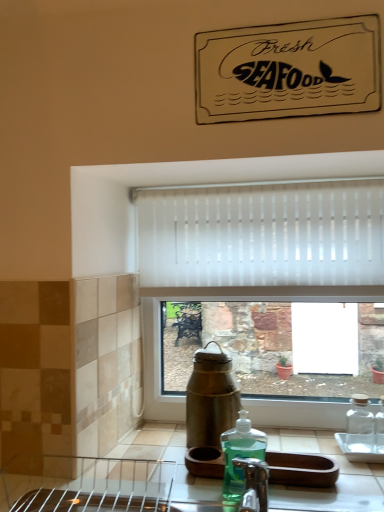
The image size is (384, 512). What do you see at coordinates (240, 454) in the screenshot? I see `green translucent liquid soap at lower center` at bounding box center [240, 454].

In order to click on green translucent liquid soap at lower center in this screenshot , I will do `click(240, 454)`.

Locate an element on the screen. This screenshot has width=384, height=512. white translucent blinds at center is located at coordinates (262, 234).

The height and width of the screenshot is (512, 384). Describe the element at coordinates (262, 234) in the screenshot. I see `white translucent blinds at center` at that location.

Find the location of a particular element. The image size is (384, 512). green translucent liquid soap at lower center is located at coordinates tap(240, 454).

Considering the positions of objects white translucent blinds at center and green translucent liquid soap at lower center in the image provided, who is more to the right, white translucent blinds at center or green translucent liquid soap at lower center?

white translucent blinds at center.

Which object is further away from the camera taking this photo, white translucent blinds at center or green translucent liquid soap at lower center?

white translucent blinds at center is more distant.

Which point is more distant from viewer, (308, 212) or (249, 439)?

The point (308, 212) is farther.

From the image's perspective, would you say white translucent blinds at center is shown under green translucent liquid soap at lower center?

Incorrect, from the image's perspective, white translucent blinds at center is higher than green translucent liquid soap at lower center.

From a real-world perspective, which is physically above, white translucent blinds at center or green translucent liquid soap at lower center?

From a 3D spatial view, white translucent blinds at center is above.

Which object is thinner, white translucent blinds at center or green translucent liquid soap at lower center?

white translucent blinds at center.

Considering the sizes of white translucent blinds at center and green translucent liquid soap at lower center in the image, is white translucent blinds at center taller or shorter than green translucent liquid soap at lower center?

Clearly, white translucent blinds at center is taller compared to green translucent liquid soap at lower center.

Considering the sizes of objects white translucent blinds at center and green translucent liquid soap at lower center in the image provided, who is smaller, white translucent blinds at center or green translucent liquid soap at lower center?

With smaller size is green translucent liquid soap at lower center.

Is white translucent blinds at center positioned beyond the bounds of green translucent liquid soap at lower center?

white translucent blinds at center is positioned outside green translucent liquid soap at lower center.

Are white translucent blinds at center and green translucent liquid soap at lower center beside each other?

No, white translucent blinds at center is not next to green translucent liquid soap at lower center.

Does white translucent blinds at center turn towards green translucent liquid soap at lower center?

No, white translucent blinds at center is not facing towards green translucent liquid soap at lower center.

Locate an element on the screen. This screenshot has height=512, width=384. curtain on the right side of green translucent liquid soap at lower center is located at coordinates (262, 234).

Consider the image. Would you say green translucent liquid soap at lower center is to the left or to the right of white translucent blinds at center in the picture?

Clearly, green translucent liquid soap at lower center is on the left of white translucent blinds at center in the image.

Is green translucent liquid soap at lower center positioned in front of white translucent blinds at center?

Yes, green translucent liquid soap at lower center is in front of white translucent blinds at center.

Does point (243, 441) come in front of point (375, 263)?

Yes, it is.

From the image's perspective, between green translucent liquid soap at lower center and white translucent blinds at center, who is located below?

green translucent liquid soap at lower center appears lower in the image.

From a real-world perspective, is green translucent liquid soap at lower center beneath white translucent blinds at center?

Yes.

Which of these two, green translucent liquid soap at lower center or white translucent blinds at center, is thinner?

white translucent blinds at center.

Is green translucent liquid soap at lower center taller than white translucent blinds at center?

In fact, green translucent liquid soap at lower center may be shorter than white translucent blinds at center.

Is green translucent liquid soap at lower center bigger than white translucent blinds at center?

Incorrect, green translucent liquid soap at lower center is not larger than white translucent blinds at center.

Is green translucent liquid soap at lower center completely or partially outside of white translucent blinds at center?

Absolutely, green translucent liquid soap at lower center is external to white translucent blinds at center.

Would you say green translucent liquid soap at lower center is a long distance from white translucent blinds at center?

green translucent liquid soap at lower center is actually quite close to white translucent blinds at center.

Is green translucent liquid soap at lower center facing towards white translucent blinds at center?

No, green translucent liquid soap at lower center is not aimed at white translucent blinds at center.

In the scene shown: What's the angular difference between green translucent liquid soap at lower center and white translucent blinds at center's facing directions?

The facing directions of green translucent liquid soap at lower center and white translucent blinds at center are 0.234 degrees apart.

The width and height of the screenshot is (384, 512). I want to click on bottle that is below the white translucent blinds at center (from the image's perspective), so click(240, 454).

Image resolution: width=384 pixels, height=512 pixels. Find the location of `curtain above the green translucent liquid soap at lower center (from a real-world perspective)`. curtain above the green translucent liquid soap at lower center (from a real-world perspective) is located at coordinates point(262,234).

This screenshot has width=384, height=512. In order to click on curtain behind the green translucent liquid soap at lower center in this screenshot , I will do `click(262, 234)`.